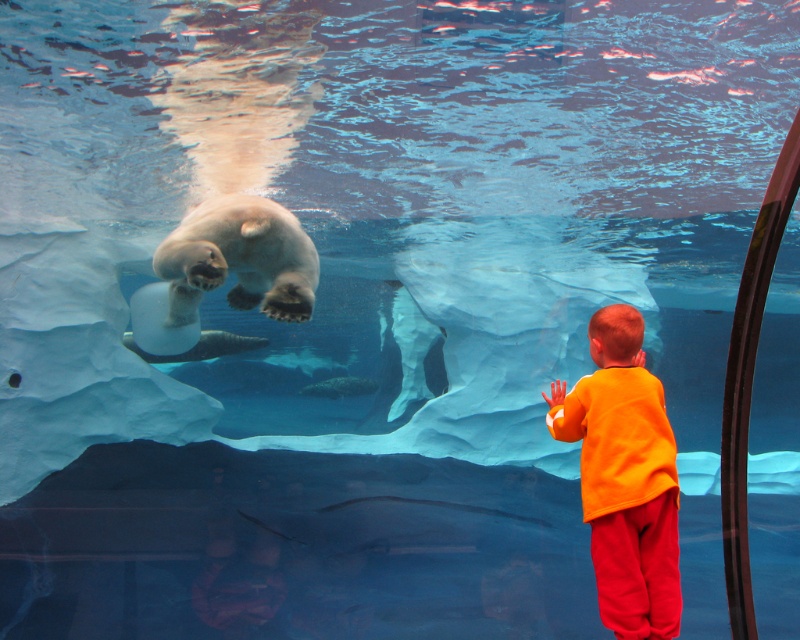
Does orange cotton shirt at lower right have a greater width compared to white matte polar bear at upper center?

Incorrect, orange cotton shirt at lower right's width does not surpass white matte polar bear at upper center's.

Can you confirm if orange cotton shirt at lower right is taller than white matte polar bear at upper center?

Indeed, orange cotton shirt at lower right has a greater height compared to white matte polar bear at upper center.

This screenshot has width=800, height=640. What do you see at coordinates (625, 477) in the screenshot? I see `orange cotton shirt at lower right` at bounding box center [625, 477].

Where is `orange cotton shirt at lower right`? The height and width of the screenshot is (640, 800). orange cotton shirt at lower right is located at coordinates (625, 477).